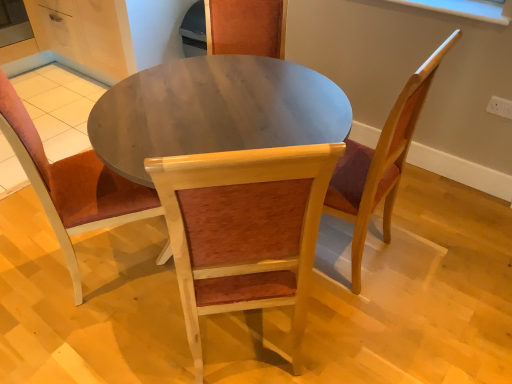
Question: Is wooden chair at center, the 2th chair in the right-to-left sequence, at the left side of wooden chair at center, the third chair in the right-to-left sequence?

Choices:
 (A) no
 (B) yes

Answer: (A)

Question: Is wooden chair at center, the 2th chair in the right-to-left sequence, located outside wooden chair at center, the third chair in the right-to-left sequence?

Choices:
 (A) no
 (B) yes

Answer: (B)

Question: Are wooden chair at center, the 2th chair in the right-to-left sequence, and wooden chair at center, the third chair in the right-to-left sequence, located far from each other?

Choices:
 (A) yes
 (B) no

Answer: (B)

Question: Is wooden chair at center, which appears as the 2th chair when viewed from the left, to the right of wooden chair at center, the third chair in the right-to-left sequence, from the viewer's perspective?

Choices:
 (A) no
 (B) yes

Answer: (B)

Question: Is wooden chair at center, which appears as the 2th chair when viewed from the left, aimed at wooden chair at center, marked as the first chair in a left-to-right arrangement?

Choices:
 (A) no
 (B) yes

Answer: (A)

Question: Is wooden chair at center, which appears as the 2th chair when viewed from the left, thinner than wooden chair at center, the third chair in the right-to-left sequence?

Choices:
 (A) yes
 (B) no

Answer: (A)

Question: From a real-world perspective, is wooden chair at center, marked as the first chair in a left-to-right arrangement, below wooden chair with cushion at center, acting as the third chair starting from the left?

Choices:
 (A) no
 (B) yes

Answer: (B)

Question: Does wooden chair at center, the third chair in the right-to-left sequence, lie in front of wooden chair with cushion at center, acting as the third chair starting from the left?

Choices:
 (A) yes
 (B) no

Answer: (A)

Question: From the image's perspective, is wooden chair at center, the third chair in the right-to-left sequence, located above wooden chair with cushion at center, which is counted as the first chair, starting from the right?

Choices:
 (A) yes
 (B) no

Answer: (B)

Question: From the image's perspective, is wooden chair at center, marked as the first chair in a left-to-right arrangement, located beneath wooden chair with cushion at center, which is counted as the first chair, starting from the right?

Choices:
 (A) yes
 (B) no

Answer: (A)

Question: Is wooden chair at center, marked as the first chair in a left-to-right arrangement, located outside wooden chair with cushion at center, which is counted as the first chair, starting from the right?

Choices:
 (A) yes
 (B) no

Answer: (A)

Question: Considering the relative positions of wooden chair at center, marked as the first chair in a left-to-right arrangement, and wooden chair with cushion at center, which is counted as the first chair, starting from the right, in the image provided, is wooden chair at center, marked as the first chair in a left-to-right arrangement, behind wooden chair with cushion at center, which is counted as the first chair, starting from the right,?

Choices:
 (A) yes
 (B) no

Answer: (B)

Question: Is wooden chair with cushion at center, acting as the third chair starting from the left, further to the viewer compared to wooden chair at center, the third chair in the right-to-left sequence?

Choices:
 (A) yes
 (B) no

Answer: (A)